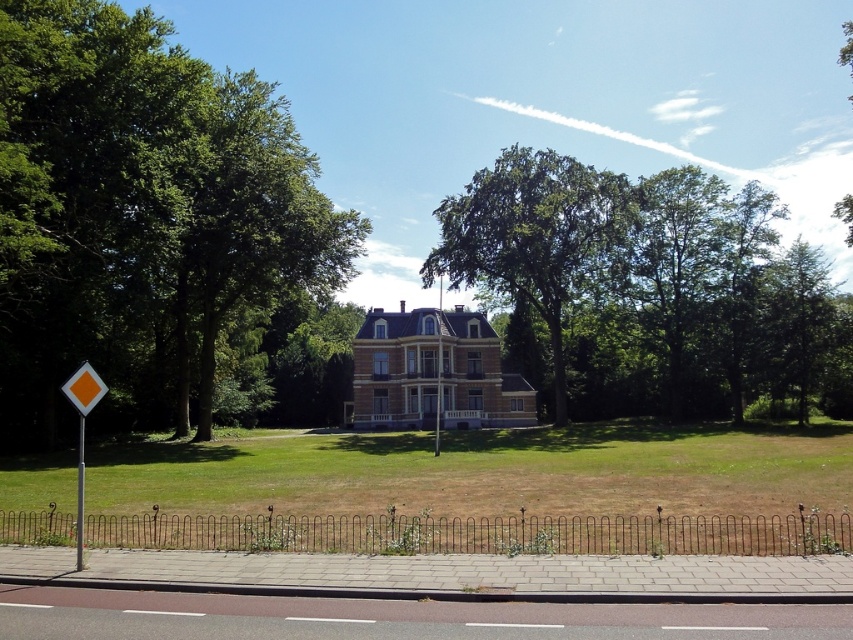
You are a landscape architect designing a garden for this suburban house. You need to place a new statue that is 1.2 meters tall. Considering the green leafy tree at center and the orange plastic diamond at left, which object would the statue be taller than?

The green leafy tree at center is taller than the orange plastic diamond at left. The statue at 1.2 meters would be taller than the orange plastic diamond at left but shorter than the green leafy tree at center.

You are a gardener planning to plant a new tree in the suburban scene. The green leafy tree at center is currently the largest plant in the area. Considering the size of the yellow plastic diamond at left, which object would require more space when planting?

The green leafy tree at center requires more space when planting because it is bigger than the yellow plastic diamond at left.

You are standing in front of the house and notice two points marked on the lawn. The first point is at coordinates point (22, 150) and the second is at point (74, 397). Which point is closer to you?

Point (22, 150) is closer to you because it is further to the viewer than point (74, 397).